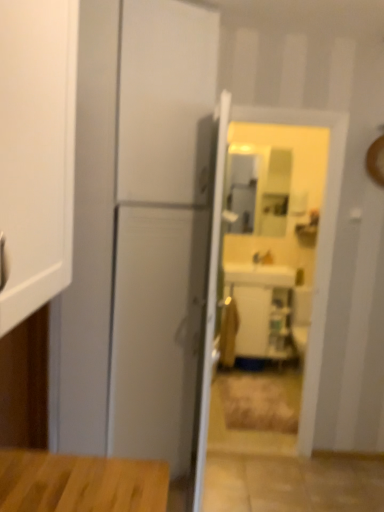
Question: From a real-world perspective, is white glossy door at center physically located above or below matte silver faucet at center?

Choices:
 (A) above
 (B) below

Answer: (B)

Question: Looking at the image, does white glossy door at center seem bigger or smaller compared to matte silver faucet at center?

Choices:
 (A) big
 (B) small

Answer: (A)

Question: Which of these objects is positioned farthest from the matte brown cabinet at center?

Choices:
 (A) white glossy door at center
 (B) white glossy sink at center
 (C) matte silver faucet at center

Answer: (A)

Question: Which is farther from the white glossy sink at center?

Choices:
 (A) matte silver faucet at center
 (B) matte brown cabinet at center
 (C) white glossy door at center

Answer: (C)